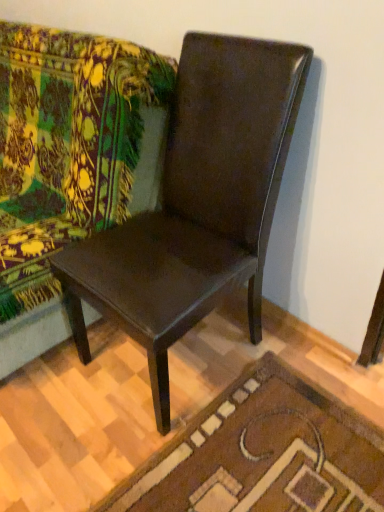
I want to click on free spot above brown textured rug at lower center (from a real-world perspective), so click(234, 455).